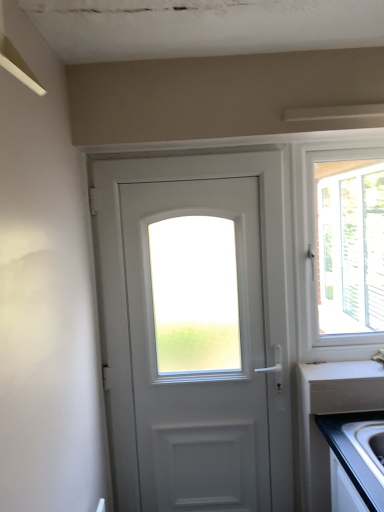
Question: Considering their positions, is white matte door at center located in front of or behind white laminate countertop at lower right?

Choices:
 (A) behind
 (B) front

Answer: (B)

Question: Based on their positions, is white matte door at center located to the left or right of white laminate countertop at lower right?

Choices:
 (A) left
 (B) right

Answer: (A)

Question: Which is farther from the white matte door at center?

Choices:
 (A) white plastic window at right
 (B) silver metallic faucet at right
 (C) white laminate countertop at lower right

Answer: (A)

Question: Based on their relative distances, which object is nearer to the white matte door at center?

Choices:
 (A) white laminate countertop at lower right
 (B) silver metallic faucet at right
 (C) white plastic window at right

Answer: (A)